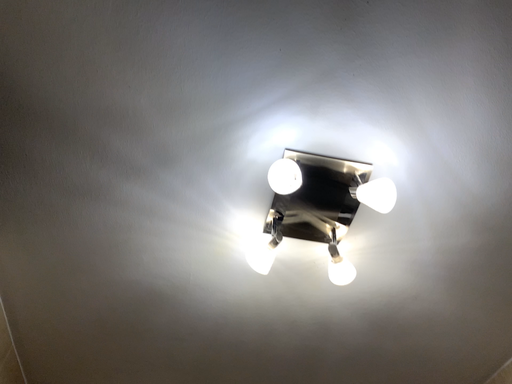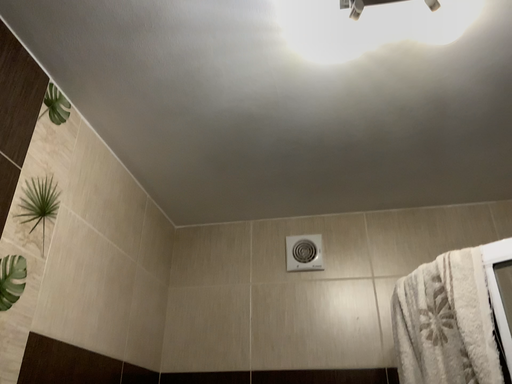
Question: Which way did the camera rotate in the video?

Choices:
 (A) rotated downward
 (B) rotated upward

Answer: (A)